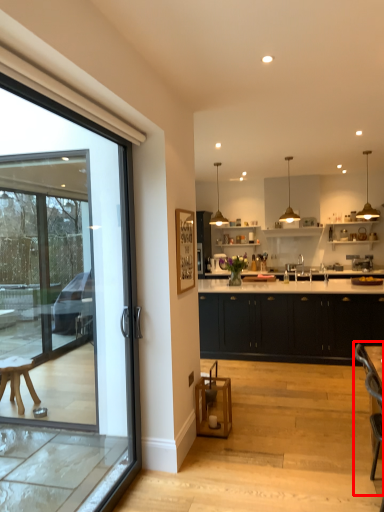
Question: Considering the relative positions of armchair (annotated by the red box) and cabinetry in the image provided, where is armchair (annotated by the red box) located with respect to the staircase?

Choices:
 (A) left
 (B) right

Answer: (A)